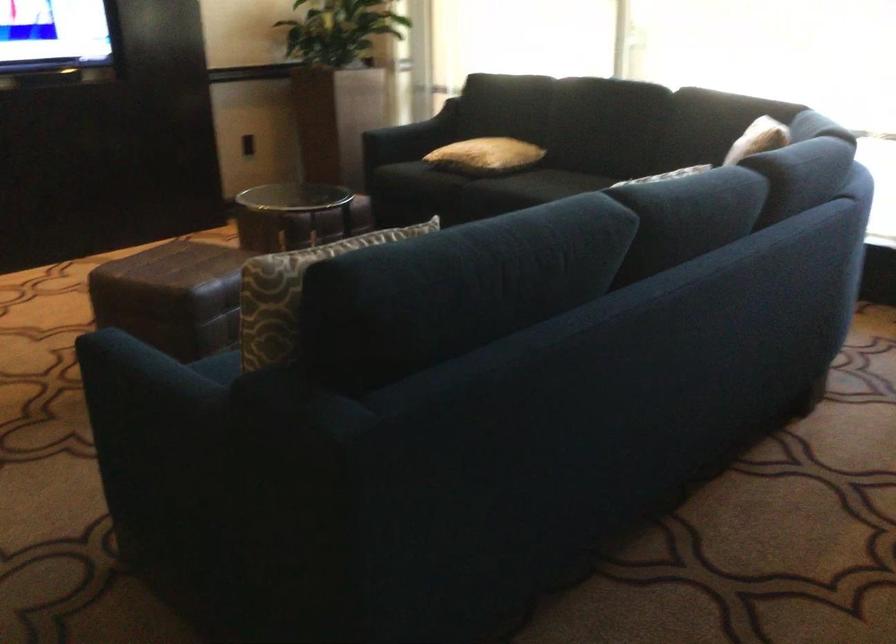
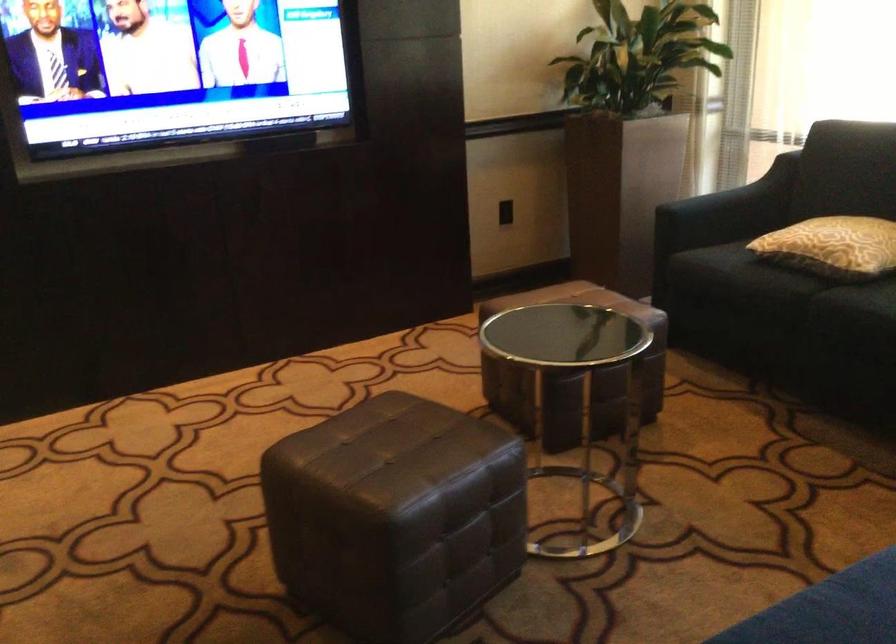
Locate, in the second image, the point that corresponds to the point at 423,129 in the first image.

(742, 196)